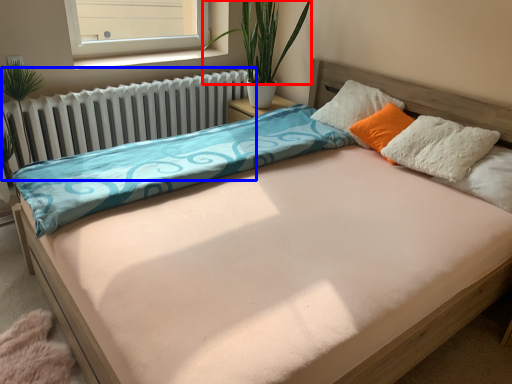
Question: Which object appears closest to the camera in this image, plant (highlighted by a red box) or radiator (highlighted by a blue box)?

Choices:
 (A) plant
 (B) radiator

Answer: (B)